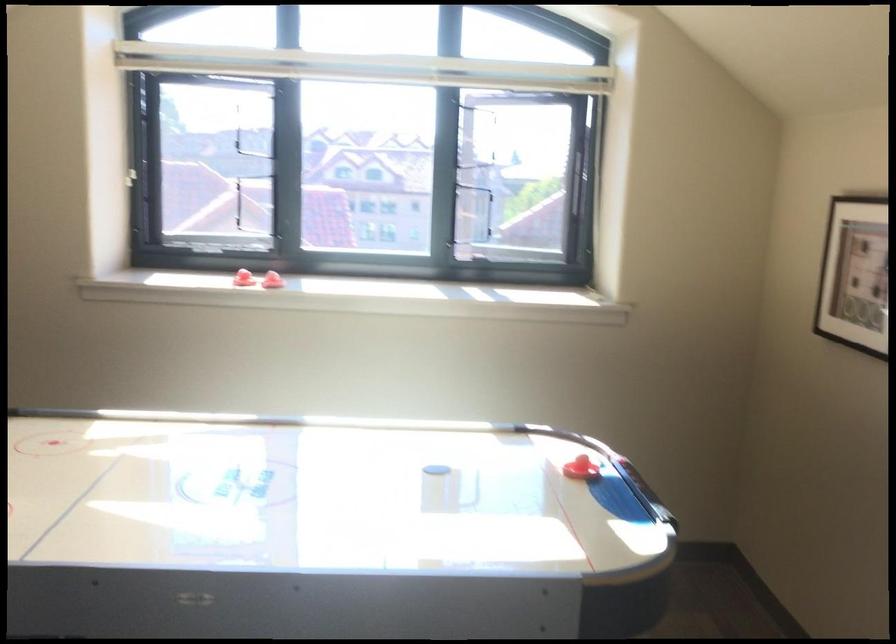
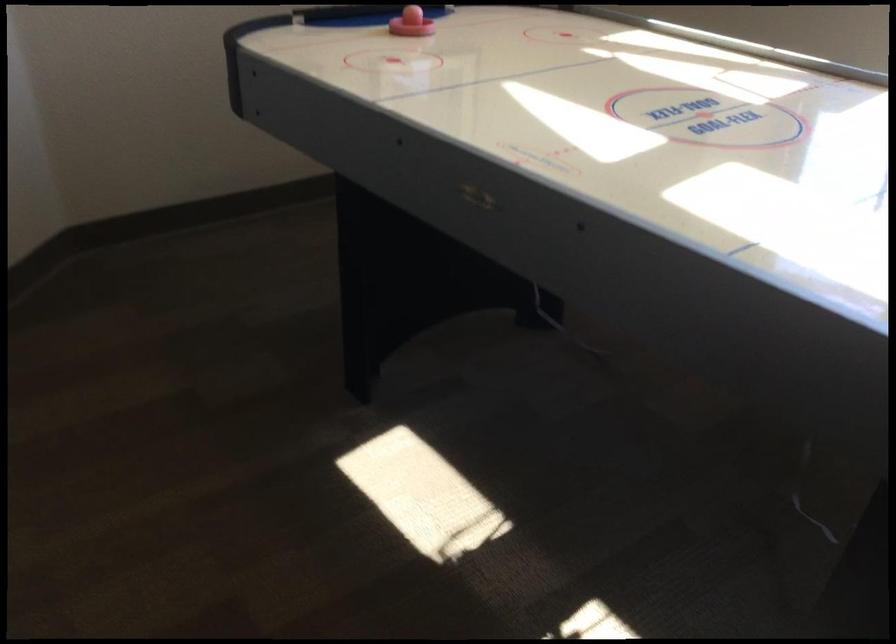
The first image is from the beginning of the video and the second image is from the end. How did the camera likely rotate when shooting the video?

The camera rotated toward left-down.